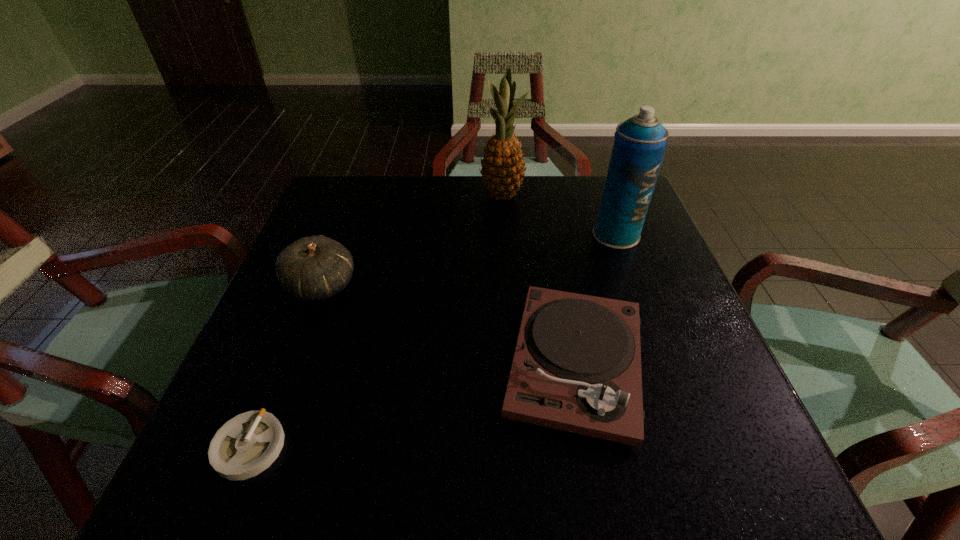
Locate an element on the screen. free space between the shortest object and the phonograph_record is located at coordinates (412, 405).

Identify the location of free space between the ashtray and the fourth nearest object. (433, 341).

Find the location of a particular element. The image size is (960, 540). vacant space that's between the phonograph_record and the ashtray is located at coordinates (412, 405).

Locate an element on the screen. vacant area that lies between the phonograph_record and the pineapple is located at coordinates (539, 279).

Identify the location of blank region between the second farthest object and the ashtray. This screenshot has height=540, width=960. (433, 341).

Identify the location of free spot between the gourd and the phonograph_record. The image size is (960, 540). (448, 325).

Locate an element on the screen. This screenshot has height=540, width=960. free spot between the fourth nearest object and the pineapple is located at coordinates (559, 215).

Locate an element on the screen. object that is the second closest one to the third shortest object is located at coordinates (576, 367).

I want to click on object that is the nearest to the second shortest object, so click(x=640, y=143).

In order to click on free region that satisfies the following two spatial constraints: 1. on the back side of the third tallest object; 2. on the right side of the farthest object in this screenshot , I will do `click(355, 195)`.